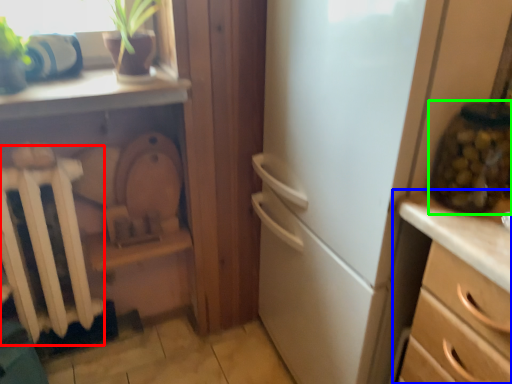
Question: Which object is positioned closest to radiator (highlighted by a red box)? Select from chest of drawers (highlighted by a blue box) and glass jar (highlighted by a green box).

Choices:
 (A) chest of drawers
 (B) glass jar

Answer: (A)